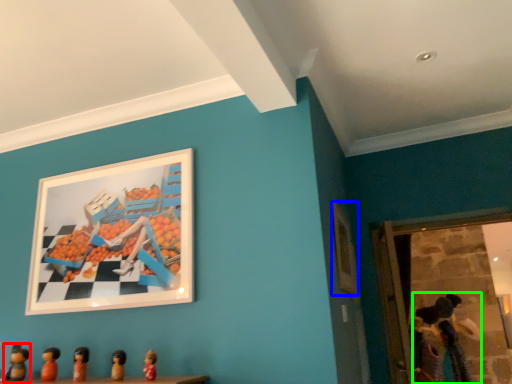
Question: Considering the real-world distances, which object is farthest from toy (highlighted by a red box)? picture frame (highlighted by a blue box) or toy (highlighted by a green box)?

Choices:
 (A) picture frame
 (B) toy

Answer: (B)